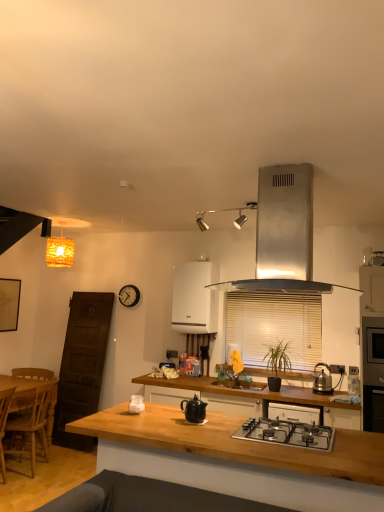
In order to click on free space to the left of white glossy jar at center, the second kitchen appliance from the bottom in this screenshot , I will do `click(118, 412)`.